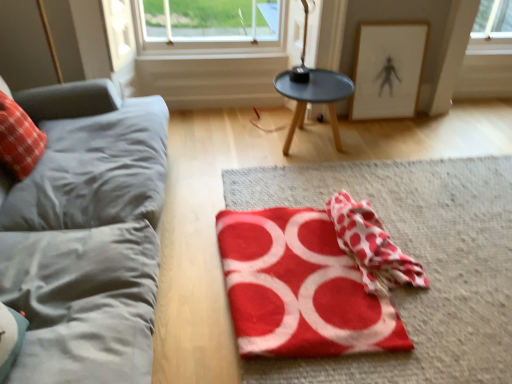
At what (x,y) coordinates should I click in order to perform the action: click on vacant area on the back side of red polka dot fabric at center. Please return your answer as a coordinate pair (x, y). Looking at the image, I should click on (366, 192).